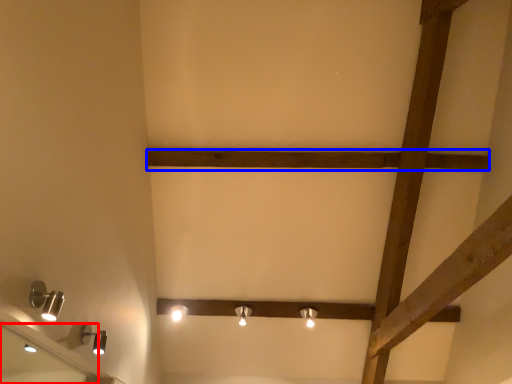
Question: Which object is further to the camera taking this photo, mirror (highlighted by a red box) or plank (highlighted by a blue box)?

Choices:
 (A) mirror
 (B) plank

Answer: (B)